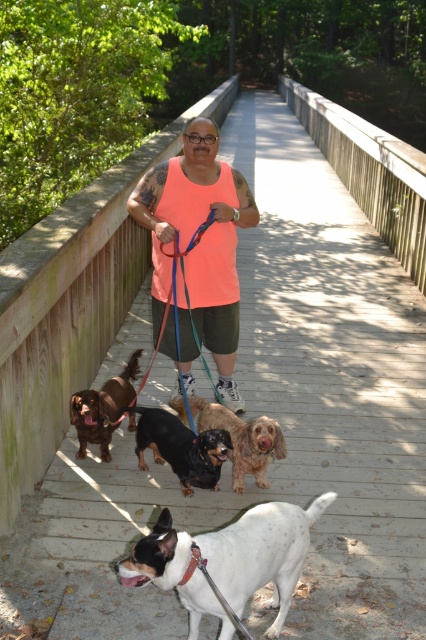
Question: Is neon orange tank top at center to the left of blue fabric leash at center from the viewer's perspective?

Choices:
 (A) yes
 (B) no

Answer: (B)

Question: Which of the following is the closest to the observer?

Choices:
 (A) (103, 460)
 (B) (189, 240)
 (C) (238, 419)

Answer: (C)

Question: Which point appears closest to the camera in this image?

Choices:
 (A) (278, 508)
 (B) (181, 396)
 (C) (85, 404)
 (D) (204, 417)

Answer: (A)

Question: Considering the relative positions of shiny brown fur at center and brown fur dog at center in the image provided, where is shiny brown fur at center located with respect to brown fur dog at center?

Choices:
 (A) above
 (B) below

Answer: (B)

Question: From the image, what is the correct spatial relationship of white speckled fur at center in relation to black shiny dachshund at center?

Choices:
 (A) above
 (B) below

Answer: (B)

Question: Estimate the real-world distances between objects in this image. Which object is farther from the blue fabric leash at center?

Choices:
 (A) black shiny dachshund at center
 (B) brown fur dog at center

Answer: (B)